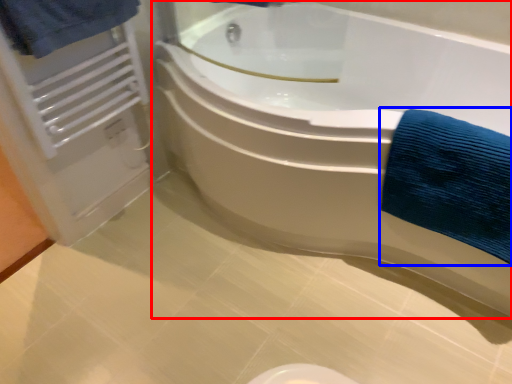
Question: Among these objects, which one is farthest to the camera, bathtub (highlighted by a red box) or bath towel (highlighted by a blue box)?

Choices:
 (A) bathtub
 (B) bath towel

Answer: (B)